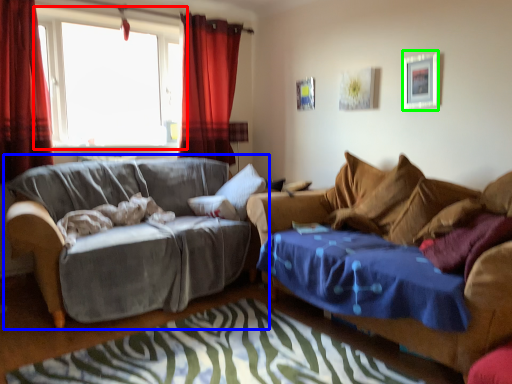
Question: Based on their relative distances, which object is farther from window (highlighted by a red box)? Choose from studio couch (highlighted by a blue box) and picture frame (highlighted by a green box).

Choices:
 (A) studio couch
 (B) picture frame

Answer: (B)